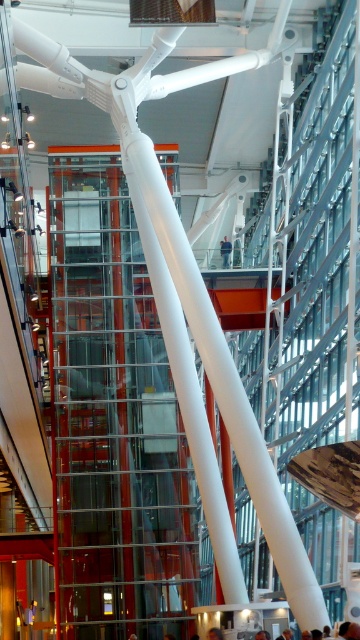
You are standing at the entrance of the modern architectural space and want to reach the point marked as point (227, 243). The path you need to take is 71.63 meters long. Is this path longer than 70 meters?

Yes, the path to point (227, 243) is 71.63 meters long, which is longer than 70 meters.

You are a fashion designer observing the modern architectural space. You notice a blue denim jacket at center and a brown hair at center. Which object has a smaller width?

The blue denim jacket at center is thinner than brown hair at center, so the blue denim jacket at center has a smaller width.